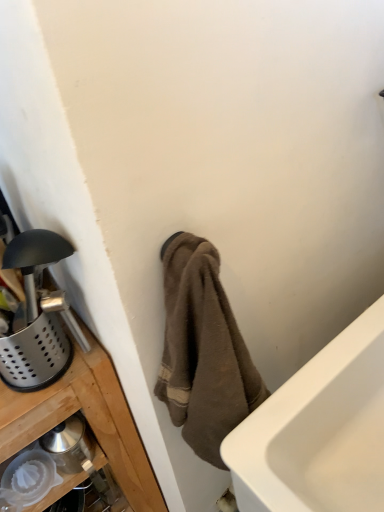
Image resolution: width=384 pixels, height=512 pixels. I want to click on brown cotton towel at center, so click(x=203, y=350).

Describe the element at coordinates (203, 350) in the screenshot. I see `brown cotton towel at center` at that location.

At what (x,y) coordinates should I click in order to perform the action: click on brown cotton towel at center. Please return your answer as a coordinate pair (x, y). The image size is (384, 512). Looking at the image, I should click on (203, 350).